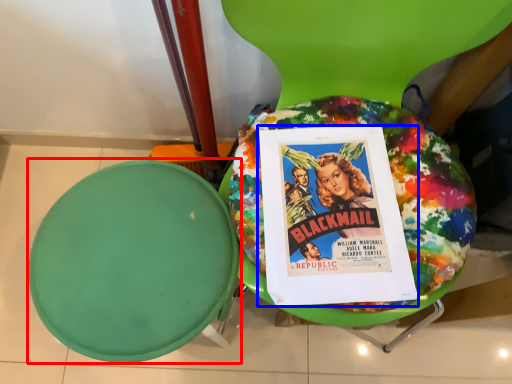
Question: Which point is closer to the camera, round table (highlighted by a red box) or comic book (highlighted by a blue box)?

Choices:
 (A) round table
 (B) comic book

Answer: (A)